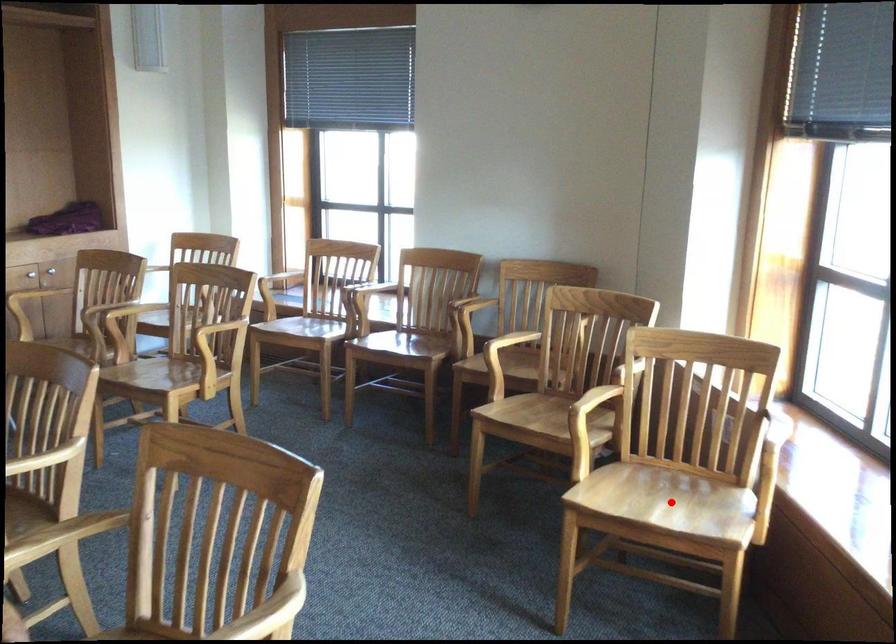
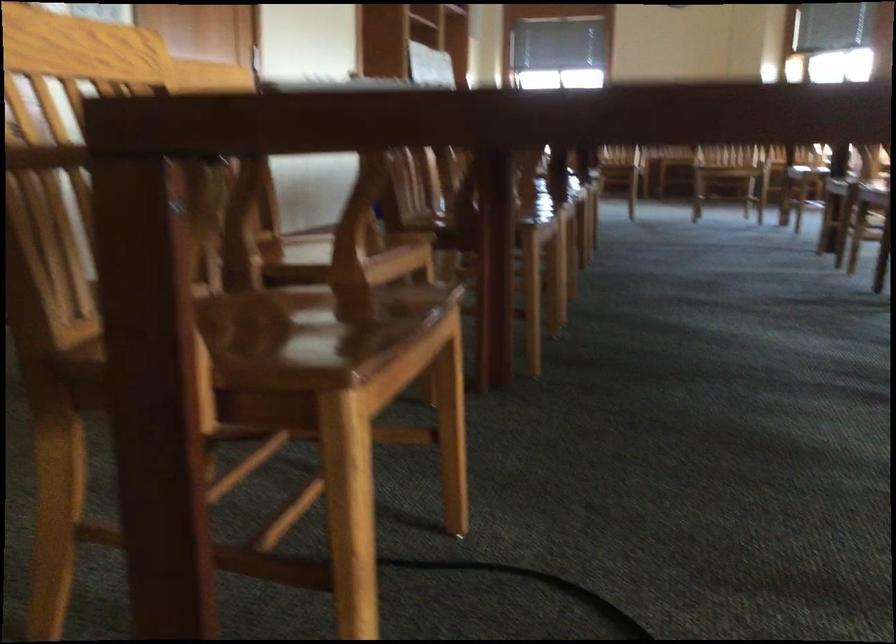
Question: I am providing you with two images of the same scene from different viewpoints. A red point is marked on the first image. At the location where the point appears in image 1, is it still visible in image 2?

Choices:
 (A) Yes
 (B) No

Answer: (B)